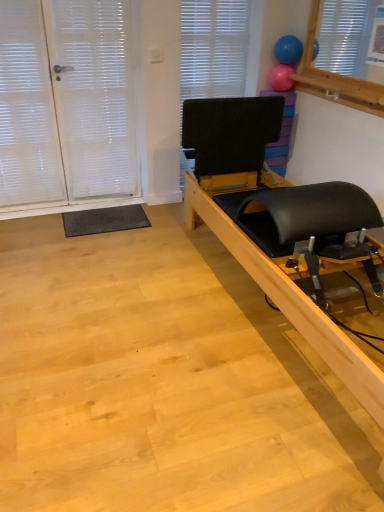
Question: Considering the relative sizes of black leather pilates reformer at right and black matte blind at upper center in the image provided, is black leather pilates reformer at right wider than black matte blind at upper center?

Choices:
 (A) no
 (B) yes

Answer: (B)

Question: From a real-world perspective, is black leather pilates reformer at right physically below black matte blind at upper center?

Choices:
 (A) yes
 (B) no

Answer: (A)

Question: From the image's perspective, is black leather pilates reformer at right beneath black matte blind at upper center?

Choices:
 (A) yes
 (B) no

Answer: (A)

Question: From a real-world perspective, is black leather pilates reformer at right located higher than black matte blind at upper center?

Choices:
 (A) no
 (B) yes

Answer: (A)

Question: Is black leather pilates reformer at right not close to black matte blind at upper center?

Choices:
 (A) yes
 (B) no

Answer: (B)

Question: Is black leather pilates reformer at right completely or partially outside of black matte blind at upper center?

Choices:
 (A) no
 (B) yes

Answer: (B)

Question: Does pink rubber balloon at upper center, positioned as the second balloon in top-to-bottom order, have a larger size compared to white textured screen door at left?

Choices:
 (A) yes
 (B) no

Answer: (B)

Question: Is pink rubber balloon at upper center, positioned as the second balloon in top-to-bottom order, oriented towards white textured screen door at left?

Choices:
 (A) yes
 (B) no

Answer: (A)

Question: From the image's perspective, is pink rubber balloon at upper center, acting as the 1th balloon starting from the bottom, below white textured screen door at left?

Choices:
 (A) yes
 (B) no

Answer: (B)

Question: Does pink rubber balloon at upper center, acting as the 1th balloon starting from the bottom, have a lesser height compared to white textured screen door at left?

Choices:
 (A) no
 (B) yes

Answer: (B)

Question: Is pink rubber balloon at upper center, acting as the 1th balloon starting from the bottom, in front of white textured screen door at left?

Choices:
 (A) yes
 (B) no

Answer: (B)

Question: Is pink rubber balloon at upper center, positioned as the second balloon in top-to-bottom order, further to camera compared to white textured screen door at left?

Choices:
 (A) no
 (B) yes

Answer: (B)

Question: Is black leather pilates reformer at right in contact with blue rubber balloon at upper right, the 2th balloon in the bottom-to-top sequence?

Choices:
 (A) yes
 (B) no

Answer: (B)